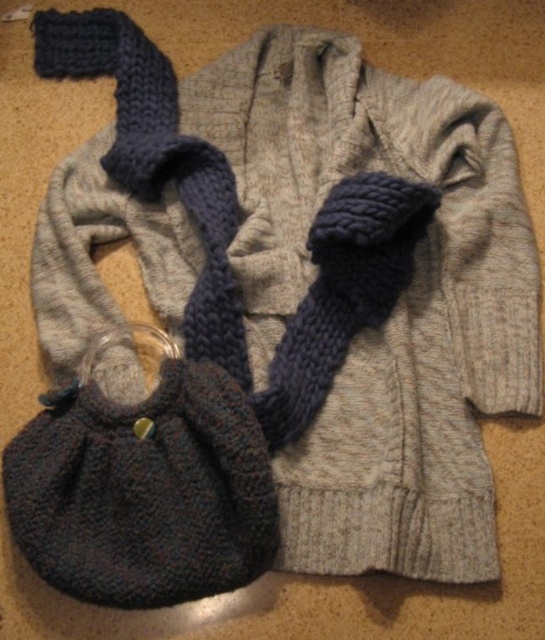
Between knitted dark gray purse at lower left and dark blue knitted scarf at center, which one is positioned higher?

dark blue knitted scarf at center is higher up.

Which of these two, knitted dark gray purse at lower left or dark blue knitted scarf at center, stands shorter?

knitted dark gray purse at lower left is shorter.

Where is `knitted dark gray purse at lower left`? This screenshot has width=545, height=640. knitted dark gray purse at lower left is located at coordinates (143, 486).

What are the coordinates of `knitted dark gray purse at lower left` in the screenshot? It's located at (143, 486).